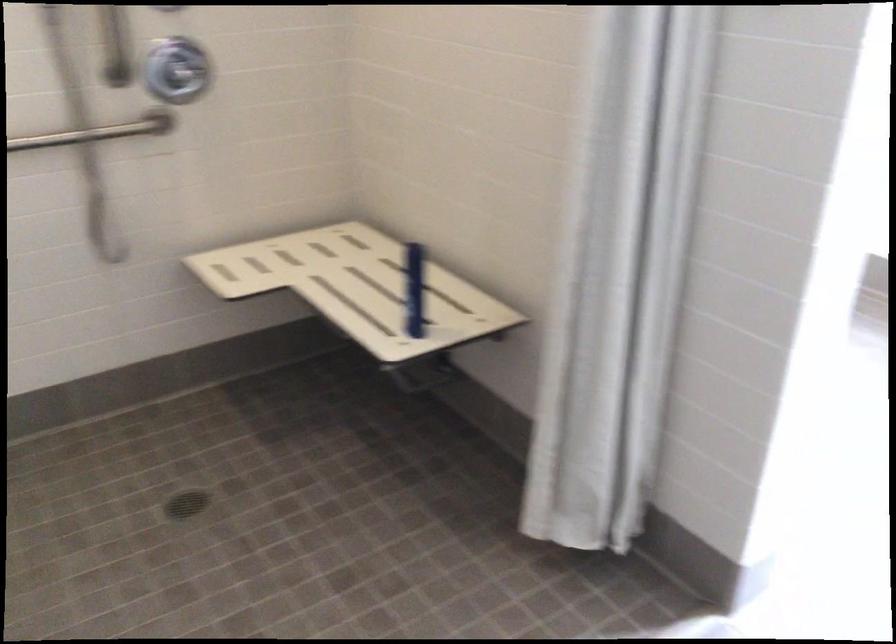
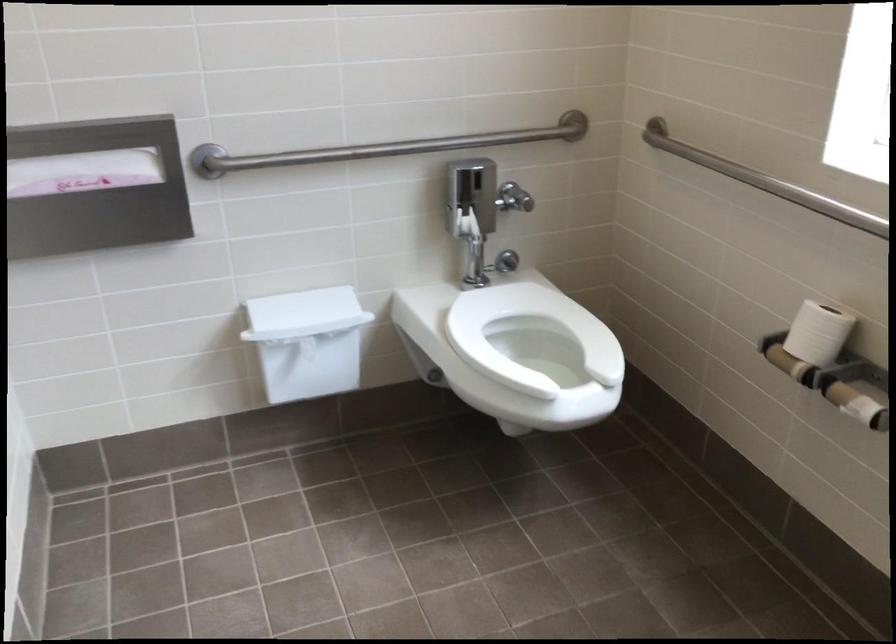
Which direction would the cameraman need to move to produce the second image?

The movement direction of the cameraman is right, forward.